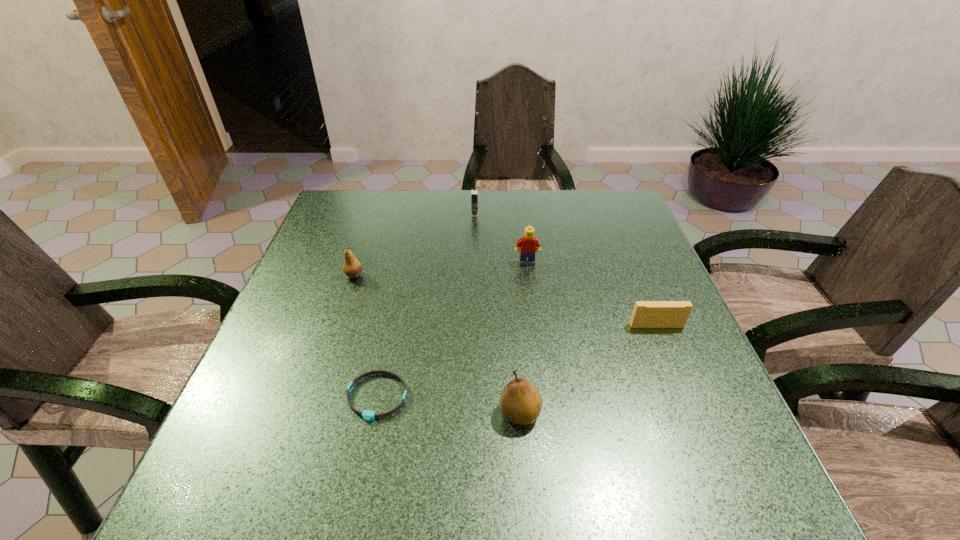
Image resolution: width=960 pixels, height=540 pixels. Find the location of `the farthest object`. the farthest object is located at coordinates (474, 192).

Find the location of a particular element. The image size is (960, 540). the third object from left to right is located at coordinates (474, 192).

Where is `the second farthest object`? The width and height of the screenshot is (960, 540). the second farthest object is located at coordinates pyautogui.click(x=526, y=246).

Locate an element on the screen. Image resolution: width=960 pixels, height=540 pixels. the left pear is located at coordinates (352, 268).

Locate an element on the screen. The image size is (960, 540). the farther pear is located at coordinates (352, 268).

Identify the location of the right pear. The height and width of the screenshot is (540, 960). (520, 402).

Find the location of a particular element. the third nearest object is located at coordinates (646, 314).

Image resolution: width=960 pixels, height=540 pixels. I want to click on the rightmost object, so click(646, 314).

Locate an element on the screen. This screenshot has width=960, height=540. wristband is located at coordinates (367, 415).

This screenshot has width=960, height=540. Find the location of `the shortest object`. the shortest object is located at coordinates (367, 415).